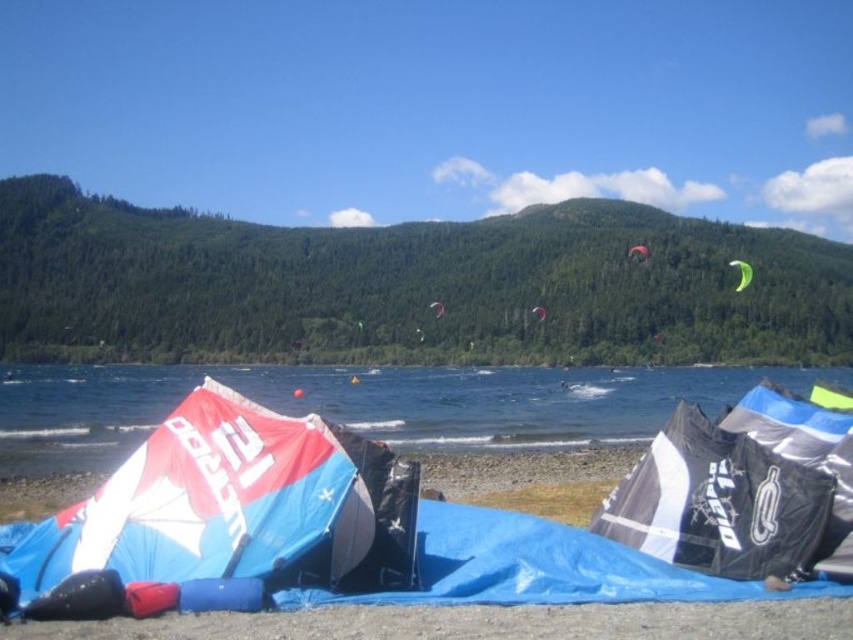
Question: Is black matte kite at right in front of green matte parachute at upper right?

Choices:
 (A) no
 (B) yes

Answer: (B)

Question: Can you confirm if blue tarpaulin tent at lower left is wider than blue fabric at lower center?

Choices:
 (A) no
 (B) yes

Answer: (A)

Question: Estimate the real-world distances between objects in this image. Which object is closer to the white matte parachute at center?

Choices:
 (A) black matte kite at right
 (B) blue tarpaulin tent at lower left

Answer: (B)

Question: Which point is closer to the camera?

Choices:
 (A) green matte parachute at upper right
 (B) blue fabric at lower center

Answer: (B)

Question: Which point is farther from the camera taking this photo?

Choices:
 (A) (645, 259)
 (B) (299, 496)
 (C) (653, 372)

Answer: (A)

Question: Does blue fabric at lower center appear over red kite at center?

Choices:
 (A) no
 (B) yes

Answer: (A)